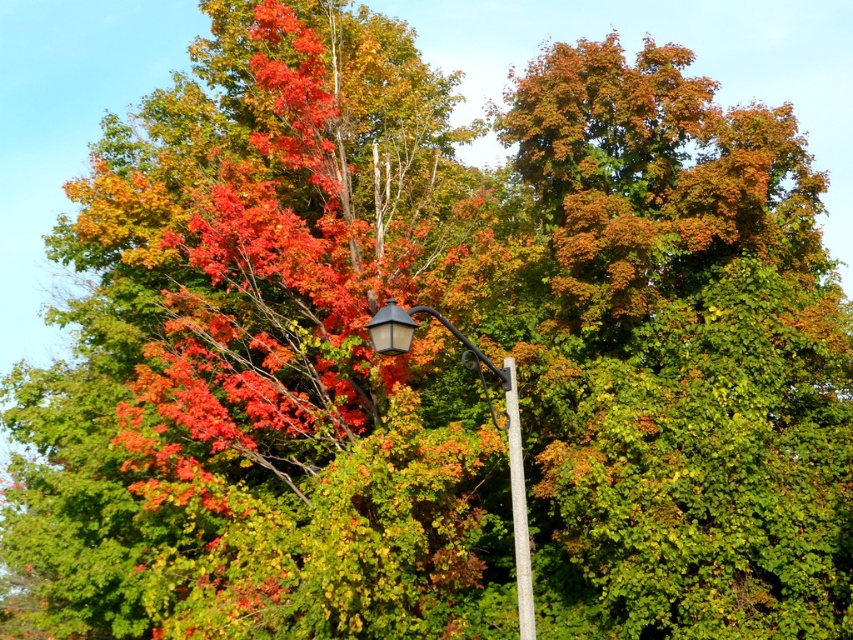
Is matte black street light at center below white smooth pole at center?

No.

Is matte black street light at center taller than white smooth pole at center?

No, matte black street light at center is not taller than white smooth pole at center.

At what (x,y) coordinates should I click in order to perform the action: click on matte black street light at center. Please return your answer as a coordinate pair (x, y). The image size is (853, 640). Looking at the image, I should click on (492, 424).

The height and width of the screenshot is (640, 853). Identify the location of matte black street light at center. pyautogui.click(x=492, y=424).